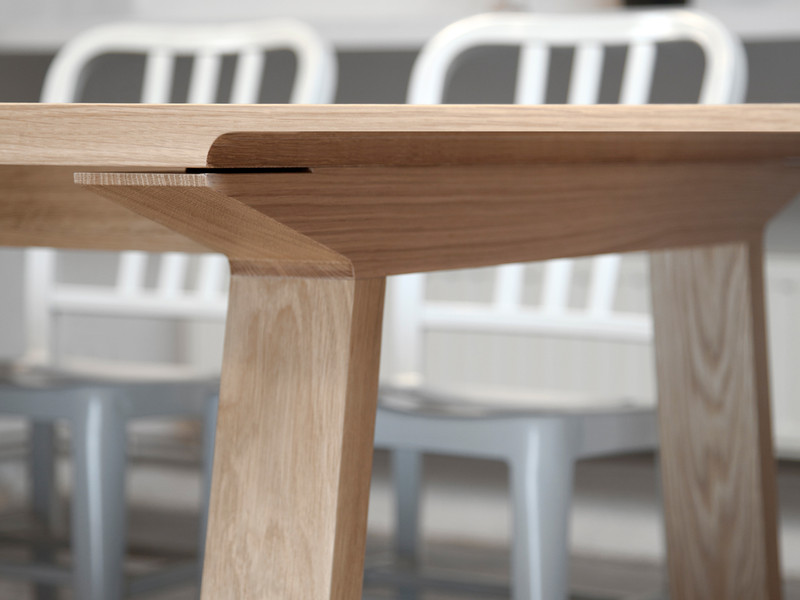
Find the location of a particular element. The height and width of the screenshot is (600, 800). area above the table top is located at coordinates pos(374,28).